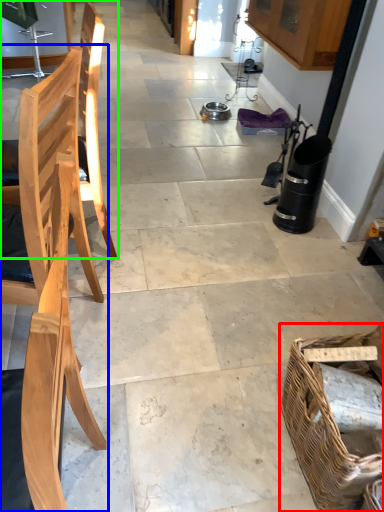
Question: Considering the real-world distances, which object is closest to picnic basket (highlighted by a red box)? chair (highlighted by a blue box) or chair (highlighted by a green box).

Choices:
 (A) chair
 (B) chair

Answer: (A)